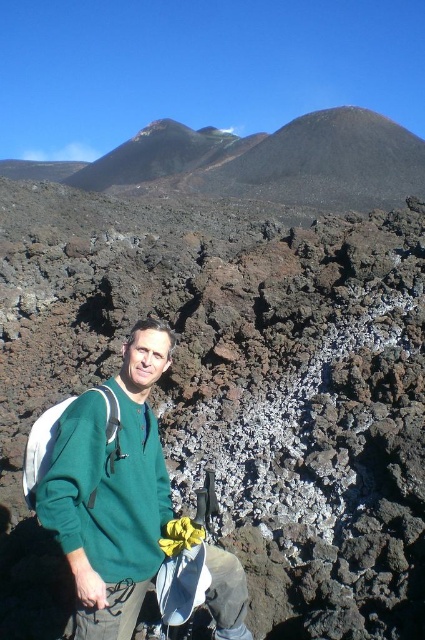
You are a hiker preparing to climb the volcanic cones in the background. You have a green matte sweater at center and a green fleece sweatshirt at center in your backpack. Which layer should you wear first for proper clothing layering?

The green fleece sweatshirt at center should be worn first as the base layer since the green matte sweater at center is positioned over it, indicating it is an outer layer meant to go over top.

You are a hiker who wants to take a photo of the volcanic cones in the background. You have a camera with a zoom lens that can focus up to 10 feet away. You notice the green matte sweater at center in your shot. Can you adjust your position so that the sweater is no longer in the frame while keeping the volcanic cones visible?

The green matte sweater at center is 9.34 feet away from viewer. Since the camera can focus up to 10 feet away, you can move slightly closer to the sweater to ensure it is within the focus range while adjusting your angle to exclude it from the frame while keeping the volcanic cones visible.